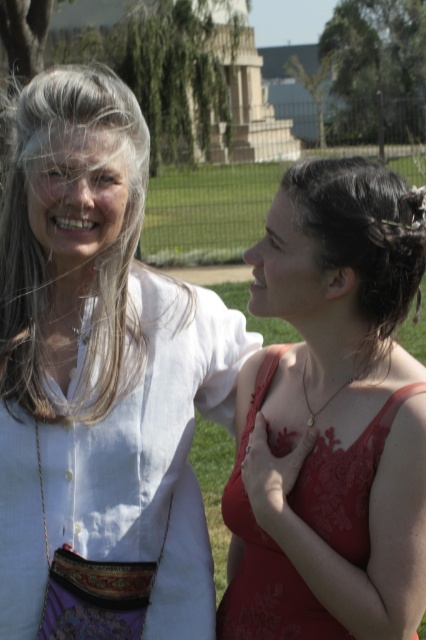
Question: Does grayhair at left have a larger size compared to lace fabric dress at center?

Choices:
 (A) no
 (B) yes

Answer: (A)

Question: Which point appears farthest from the camera in this image?

Choices:
 (A) (86, 387)
 (B) (408, 252)

Answer: (A)

Question: Observing the image, what is the correct spatial positioning of white cotton shirt at upper left in reference to dark brown silky hair at right?

Choices:
 (A) below
 (B) above

Answer: (A)

Question: Estimate the real-world distances between objects in this image. Which object is closer to the lace fabric dress at center?

Choices:
 (A) dark brown silky hair at right
 (B) grayhair at left

Answer: (A)

Question: Considering the real-world distances, which object is closest to the grayhair at left?

Choices:
 (A) white cotton shirt at upper left
 (B) lace fabric dress at center
 (C) dark brown silky hair at right

Answer: (A)

Question: Does grayhair at left have a larger size compared to lace fabric dress at center?

Choices:
 (A) yes
 (B) no

Answer: (B)